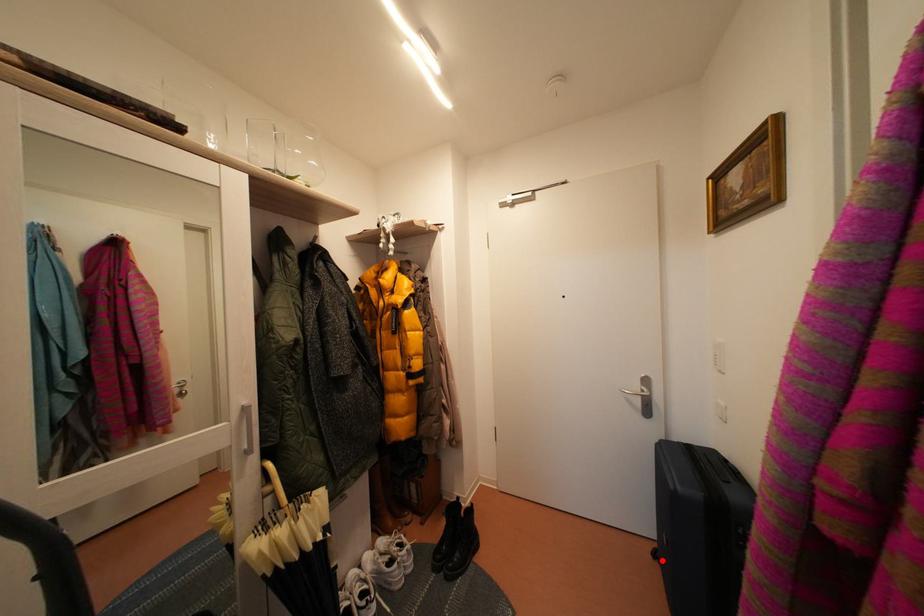
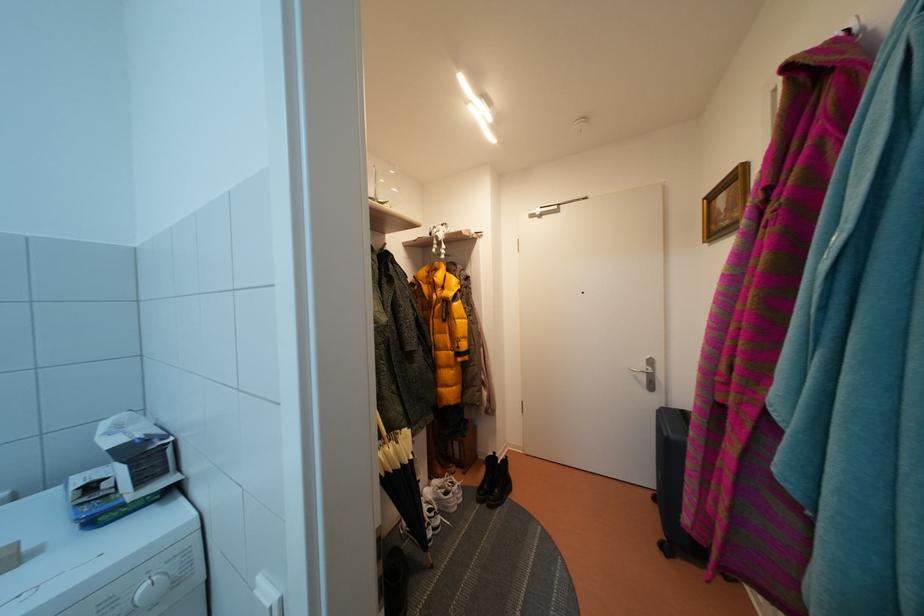
Question: I am providing you with two images of the same scene from different viewpoints. Image1 has a red point marked. In image2, the corresponding 3D location appears at what relative position? Reply with the corresponding letter.

Choices:
 (A) Closer
 (B) Farther

Answer: (B)